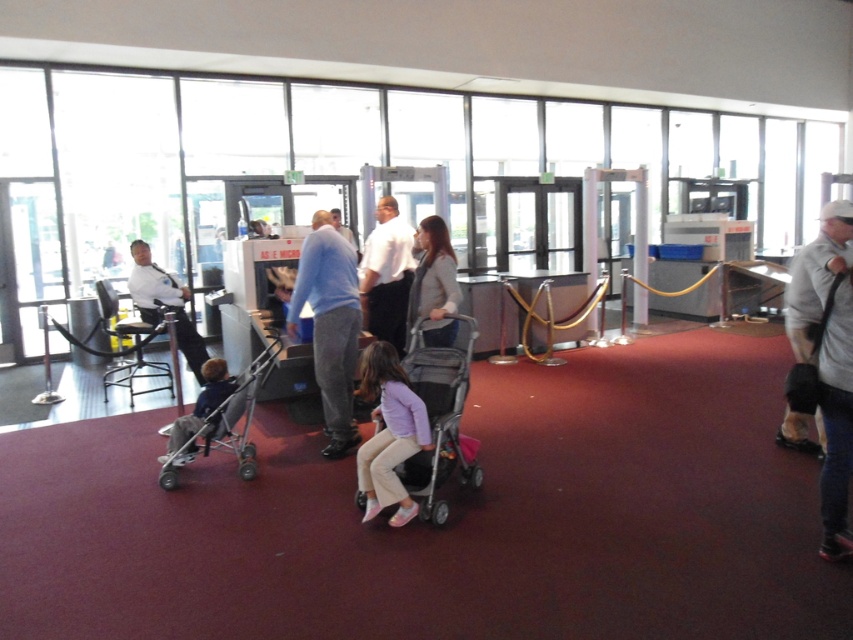
You are a security guard at the airport and need to check the items in the scene. Which object, the light brown textured jacket at center or the dark blue fabric stroller at lower left, is positioned higher from the ground?

The light brown textured jacket at center is located above the dark blue fabric stroller at lower left, so it is positioned higher from the ground.

In the scene shown: You are an airport staff member standing at the security checkpoint. You need to direct the adult wearing the gray fabric jacket at center to move their stroller to the right side. However, there is another adult wearing the white shirt at center already there. Can you tell which adult is closer to you so you can address them first?

The gray fabric jacket at center is closer to the viewer than the white shirt at center, so you should address the adult in the gray fabric jacket at center first.

You are an airport security officer and you need to locate the gray fabric jacket at center. Where would you find it in the image?

The gray fabric jacket at center is located at the 2D coordinates point (x=825, y=360) in the image.